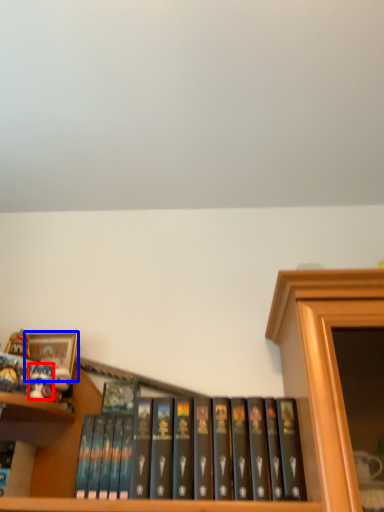
Question: Which object is further to the camera taking this photo, toy (highlighted by a red box) or picture frame (highlighted by a blue box)?

Choices:
 (A) toy
 (B) picture frame

Answer: (B)